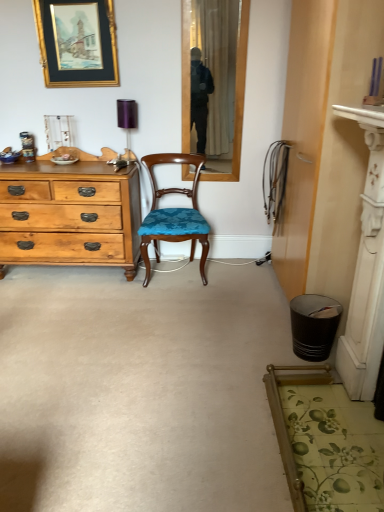
Question: Is black textured trash can at lower right not near purple fabric lampshade at upper center?

Choices:
 (A) no
 (B) yes

Answer: (B)

Question: From the image's perspective, is black textured trash can at lower right on purple fabric lampshade at upper center?

Choices:
 (A) no
 (B) yes

Answer: (A)

Question: From the image's perspective, is black textured trash can at lower right below purple fabric lampshade at upper center?

Choices:
 (A) no
 (B) yes

Answer: (B)

Question: Can you confirm if black textured trash can at lower right is positioned to the left of purple fabric lampshade at upper center?

Choices:
 (A) yes
 (B) no

Answer: (B)

Question: Is black textured trash can at lower right oriented away from purple fabric lampshade at upper center?

Choices:
 (A) yes
 (B) no

Answer: (B)

Question: From a real-world perspective, is black textured trash can at lower right over purple fabric lampshade at upper center?

Choices:
 (A) yes
 (B) no

Answer: (B)

Question: Is wooden chair with blue upholstery at center next to metallic can at left?

Choices:
 (A) yes
 (B) no

Answer: (B)

Question: Is wooden chair with blue upholstery at center in front of metallic can at left?

Choices:
 (A) yes
 (B) no

Answer: (A)

Question: Is metallic can at left a part of wooden chair with blue upholstery at center?

Choices:
 (A) yes
 (B) no

Answer: (B)

Question: From the image's perspective, is wooden chair with blue upholstery at center on metallic can at left?

Choices:
 (A) yes
 (B) no

Answer: (B)

Question: Considering the relative sizes of wooden chair with blue upholstery at center and metallic can at left in the image provided, is wooden chair with blue upholstery at center shorter than metallic can at left?

Choices:
 (A) no
 (B) yes

Answer: (A)

Question: Is wooden chair with blue upholstery at center positioned far away from metallic can at left?

Choices:
 (A) yes
 (B) no

Answer: (A)

Question: Considering the relative sizes of black textured trash can at lower right and gold-framed picture at upper left in the image provided, is black textured trash can at lower right smaller than gold-framed picture at upper left?

Choices:
 (A) no
 (B) yes

Answer: (B)